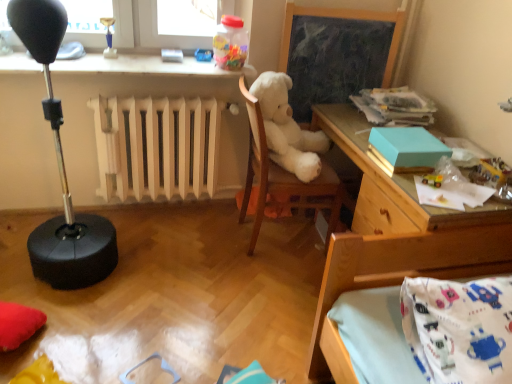
Locate an element on the screen. Image resolution: width=512 pixels, height=384 pixels. vacant space to the right of metallic yellow toy car at upper right, the 1th toy from the front is located at coordinates (478, 194).